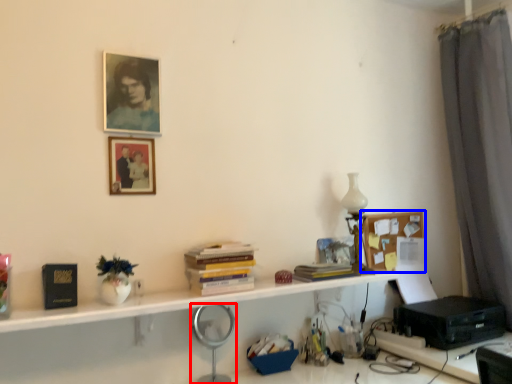
Question: Which point is further to the camera, magnifying glass (highlighted by a red box) or bulletin board (highlighted by a blue box)?

Choices:
 (A) magnifying glass
 (B) bulletin board

Answer: (B)